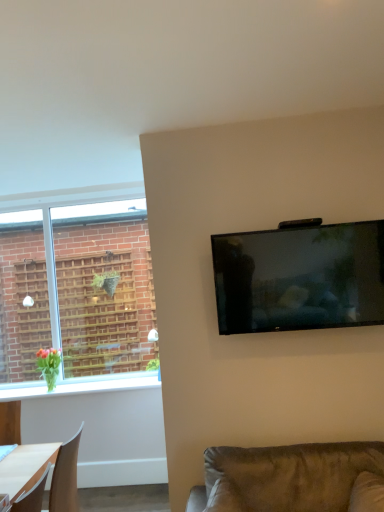
I want to click on matte black tv at upper right, so click(300, 278).

Is matte black tv at upper right far away from white glossy window sill at lower left?

Yes.

Does matte black tv at upper right have a greater height compared to white glossy window sill at lower left?

Indeed, matte black tv at upper right has a greater height compared to white glossy window sill at lower left.

How different are the orientations of matte black tv at upper right and white glossy window sill at lower left in degrees?

They differ by 0.728 degrees in their facing directions.

In the image, is matte black tv at upper right on the left side or the right side of white glossy window sill at lower left?

matte black tv at upper right is positioned on white glossy window sill at lower left's right side.

Is matte black tv at upper right behind suede-like brown couch at lower right?

Yes, matte black tv at upper right is further from the viewer.

Between matte black tv at upper right and suede-like brown couch at lower right, which one appears on the right side from the viewer's perspective?

matte black tv at upper right.

Does point (231, 250) come behind point (269, 509)?

That is True.

This screenshot has height=512, width=384. I want to click on television above the suede-like brown couch at lower right (from a real-world perspective), so click(x=300, y=278).

Could you tell me if suede-like brown couch at lower right is facing matte black tv at upper right?

No, suede-like brown couch at lower right is not oriented towards matte black tv at upper right.

From a real-world perspective, which is physically below, suede-like brown couch at lower right or matte black tv at upper right?

suede-like brown couch at lower right is physically lower.

Is point (319, 502) less distant than point (360, 315)?

That is True.

Is suede-like brown couch at lower right to the left or to the right of matte black tv at upper right in the image?

Clearly, suede-like brown couch at lower right is on the left of matte black tv at upper right in the image.

Is white glossy window sill at lower left inside the boundaries of suede-like brown couch at lower right, or outside?

white glossy window sill at lower left is not enclosed by suede-like brown couch at lower right.

Is white glossy window sill at lower left positioned in front of suede-like brown couch at lower right?

No, it is behind suede-like brown couch at lower right.

From the image's perspective, does white glossy window sill at lower left appear higher than suede-like brown couch at lower right?

Incorrect, from the image's perspective, white glossy window sill at lower left is lower than suede-like brown couch at lower right.

Can you confirm if suede-like brown couch at lower right is wider than white glossy window sill at lower left?

Yes, suede-like brown couch at lower right is wider than white glossy window sill at lower left.

From the image's perspective, is suede-like brown couch at lower right beneath white glossy window sill at lower left?

Actually, suede-like brown couch at lower right appears above white glossy window sill at lower left in the image.

Is suede-like brown couch at lower right outside of white glossy window sill at lower left?

suede-like brown couch at lower right is positioned outside white glossy window sill at lower left.

Is white glossy window sill at lower left inside or outside of matte black tv at upper right?

white glossy window sill at lower left exists outside the volume of matte black tv at upper right.

Does white glossy window sill at lower left come behind matte black tv at upper right?

Yes.

Is white glossy window sill at lower left positioned far away from matte black tv at upper right?

Yes.

Locate an element on the screen. This screenshot has width=384, height=512. television located above the white glossy window sill at lower left (from a real-world perspective) is located at coordinates (300, 278).

Find the location of `television on the right of suede-like brown couch at lower right`. television on the right of suede-like brown couch at lower right is located at coordinates (300, 278).

Based on their spatial positions, is suede-like brown couch at lower right or white glossy window sill at lower left further from matte black tv at upper right?

→ white glossy window sill at lower left is positioned further to the anchor matte black tv at upper right.

Based on the photo, from the image, which object appears to be farther from white glossy window sill at lower left, suede-like brown couch at lower right or matte black tv at upper right?

matte black tv at upper right is positioned further to the anchor white glossy window sill at lower left.

From the image, which object appears to be nearer to matte black tv at upper right, white glossy window sill at lower left or suede-like brown couch at lower right?

suede-like brown couch at lower right is closer to matte black tv at upper right.

Considering their positions, is matte black tv at upper right positioned further to white glossy window sill at lower left than suede-like brown couch at lower right?

matte black tv at upper right lies further to white glossy window sill at lower left than the other object.

Looking at the image, which one is located further to suede-like brown couch at lower right, matte black tv at upper right or white glossy window sill at lower left?

white glossy window sill at lower left.

Considering their positions, is white glossy window sill at lower left positioned closer to suede-like brown couch at lower right than matte black tv at upper right?

Based on the image, matte black tv at upper right appears to be nearer to suede-like brown couch at lower right.

Where is `television between suede-like brown couch at lower right and white glossy window sill at lower left in the front-back direction`? The width and height of the screenshot is (384, 512). television between suede-like brown couch at lower right and white glossy window sill at lower left in the front-back direction is located at coordinates (300, 278).